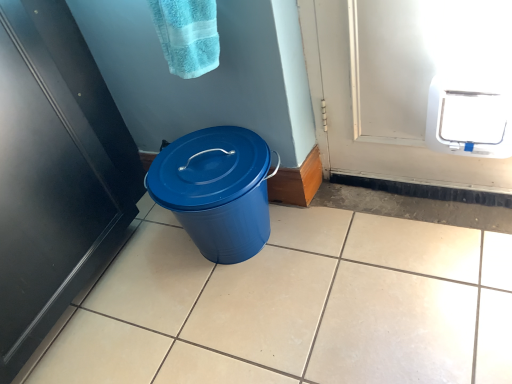
In the scene shown: Measure the distance between point (57, 73) and camera.

The distance of point (57, 73) from camera is 1.04 meters.

You are a GUI agent. You are given a task and a screenshot of the screen. Output one action in this format:
    pyautogui.click(x=<x>, y=<y>)
    Task: Click on the blue plastic trash can at center
    The width and height of the screenshot is (512, 384).
    Given the screenshot: What is the action you would take?
    pyautogui.click(x=216, y=190)

Is turquoise terry cloth towel at upper center wider or thinner than blue plastic trash can at center?

Considering their sizes, turquoise terry cloth towel at upper center looks slimmer than blue plastic trash can at center.

Is turquoise terry cloth towel at upper center in front of or behind blue plastic trash can at center in the image?

turquoise terry cloth towel at upper center is positioned closer to the viewer than blue plastic trash can at center.

Based on the photo, does turquoise terry cloth towel at upper center have a smaller size compared to blue plastic trash can at center?

Yes, turquoise terry cloth towel at upper center is smaller than blue plastic trash can at center.

Find the location of a particular element. bath towel above the blue plastic trash can at center (from a real-world perspective) is located at coordinates (187, 35).

What's the angular difference between blue plastic trash can at center and black matte door at left's facing directions?

The angular difference between blue plastic trash can at center and black matte door at left is 86.5 degrees.

This screenshot has height=384, width=512. In the image, there is a black matte door at left. What are the coordinates of `waste container below it (from the image's perspective)` in the screenshot? It's located at (216, 190).

Which is correct: blue plastic trash can at center is inside black matte door at left, or outside of it?

blue plastic trash can at center is not enclosed by black matte door at left.

Which of these two, blue plastic trash can at center or turquoise terry cloth towel at upper center, is smaller?

Smaller between the two is turquoise terry cloth towel at upper center.

Is blue plastic trash can at center not near turquoise terry cloth towel at upper center?

That's not correct — blue plastic trash can at center is a little close to turquoise terry cloth towel at upper center.

From the image's perspective, does blue plastic trash can at center appear higher than turquoise terry cloth towel at upper center?

No, from the image's perspective, blue plastic trash can at center is not on top of turquoise terry cloth towel at upper center.

Is blue plastic trash can at center positioned in front of turquoise terry cloth towel at upper center?

That is False.

Considering the positions of objects white plastic pet door at upper right and black matte door at left in the image provided, who is in front, white plastic pet door at upper right or black matte door at left?

black matte door at left.

Is white plastic pet door at upper right facing away from black matte door at left?

No, white plastic pet door at upper right's orientation is not away from black matte door at left.

Are white plastic pet door at upper right and black matte door at left located far from each other?

Yes, white plastic pet door at upper right and black matte door at left are located far from each other.

At what (x,y) coordinates should I click in order to perform the action: click on appliance on the right of black matte door at left. Please return your answer as a coordinate pair (x, y). This screenshot has height=384, width=512. Looking at the image, I should click on (469, 116).

Can you tell me how much white plastic pet door at upper right and blue plastic trash can at center differ in facing direction?

white plastic pet door at upper right and blue plastic trash can at center are facing 3.99 degrees away from each other.

Could you tell me if white plastic pet door at upper right is facing blue plastic trash can at center?

No, white plastic pet door at upper right is not facing towards blue plastic trash can at center.

Consider the image. From the image's perspective, is white plastic pet door at upper right under blue plastic trash can at center?

Actually, white plastic pet door at upper right appears above blue plastic trash can at center in the image.

From their relative heights in the image, would you say white plastic pet door at upper right is taller or shorter than blue plastic trash can at center?

white plastic pet door at upper right is shorter than blue plastic trash can at center.

Who is shorter, black matte door at left or blue plastic trash can at center?

blue plastic trash can at center.

Is black matte door at left surrounding blue plastic trash can at center?

No, blue plastic trash can at center is not a part of black matte door at left.

Is black matte door at left thinner than blue plastic trash can at center?

In fact, black matte door at left might be wider than blue plastic trash can at center.

In the scene shown: Is black matte door at left turned away from white plastic pet door at upper right?

No, black matte door at left is not facing away from white plastic pet door at upper right.

Is black matte door at left to the left or to the right of white plastic pet door at upper right in the image?

Clearly, black matte door at left is on the left of white plastic pet door at upper right in the image.

From a real-world perspective, between black matte door at left and white plastic pet door at upper right, who is vertically higher?

In real-world perspective, black matte door at left is above.

I want to click on bath towel above the blue plastic trash can at center (from a real-world perspective), so click(x=187, y=35).

Find the location of a particular element. The width and height of the screenshot is (512, 384). waste container below the black matte door at left (from the image's perspective) is located at coordinates (216, 190).

Based on their spatial positions, is black matte door at left or blue plastic trash can at center further from white plastic pet door at upper right?

black matte door at left is positioned further to the anchor white plastic pet door at upper right.

Considering their positions, is white plastic pet door at upper right positioned further to black matte door at left than turquoise terry cloth towel at upper center?

white plastic pet door at upper right is positioned further to the anchor black matte door at left.

Based on their spatial positions, is blue plastic trash can at center or turquoise terry cloth towel at upper center closer to white plastic pet door at upper right?

blue plastic trash can at center.

Considering their positions, is black matte door at left positioned further to blue plastic trash can at center than turquoise terry cloth towel at upper center?

black matte door at left.

Looking at this image, which object lies nearer to the anchor point blue plastic trash can at center, black matte door at left or white plastic pet door at upper right?

black matte door at left lies closer to blue plastic trash can at center than the other object.

Which object lies further to the anchor point black matte door at left, turquoise terry cloth towel at upper center or blue plastic trash can at center?

turquoise terry cloth towel at upper center is further to black matte door at left.

Estimate the real-world distances between objects in this image. Which object is closer to turquoise terry cloth towel at upper center, black matte door at left or blue plastic trash can at center?

blue plastic trash can at center lies closer to turquoise terry cloth towel at upper center than the other object.

Estimate the real-world distances between objects in this image. Which object is closer to turquoise terry cloth towel at upper center, black matte door at left or white plastic pet door at upper right?

black matte door at left.

Identify the location of waste container situated between turquoise terry cloth towel at upper center and white plastic pet door at upper right from left to right. (216, 190).

This screenshot has width=512, height=384. Identify the location of bath towel situated between black matte door at left and blue plastic trash can at center from left to right. (187, 35).

The image size is (512, 384). What are the coordinates of `waste container situated between black matte door at left and white plastic pet door at upper right from left to right` in the screenshot? It's located at (216, 190).

The image size is (512, 384). What are the coordinates of `bath towel situated between black matte door at left and white plastic pet door at upper right from left to right` in the screenshot? It's located at (187, 35).